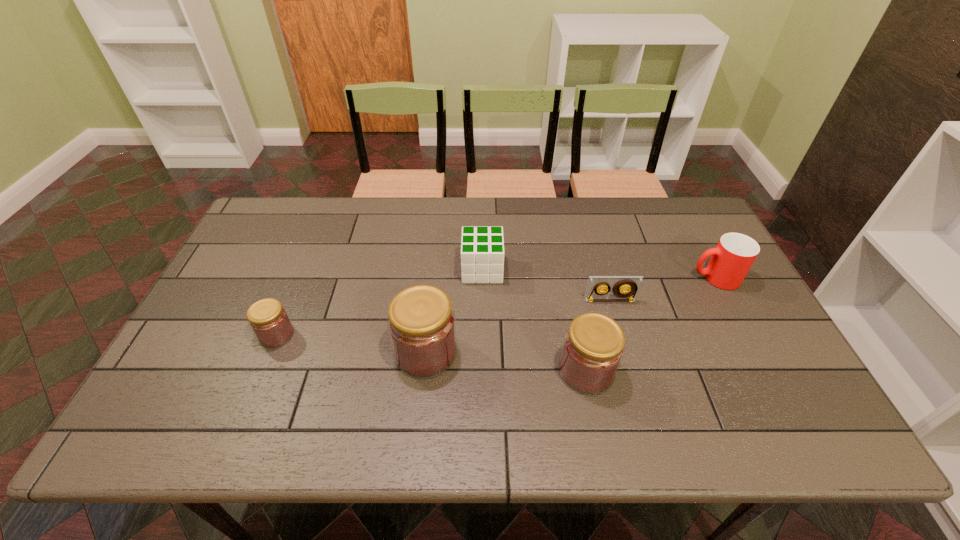
Find the location of `jam that is the second closest one to the leftmost object`. jam that is the second closest one to the leftmost object is located at coordinates coord(593,348).

The height and width of the screenshot is (540, 960). I want to click on vacant area that satisfies the following two spatial constraints: 1. on the red face of the cube; 2. on the side of the rightmost object with the handle, so click(x=482, y=278).

Where is `blank space that satisfies the following two spatial constraints: 1. on the red face of the third object from left to right; 2. on the side of the cup with the handle`? The width and height of the screenshot is (960, 540). blank space that satisfies the following two spatial constraints: 1. on the red face of the third object from left to right; 2. on the side of the cup with the handle is located at coordinates (482, 278).